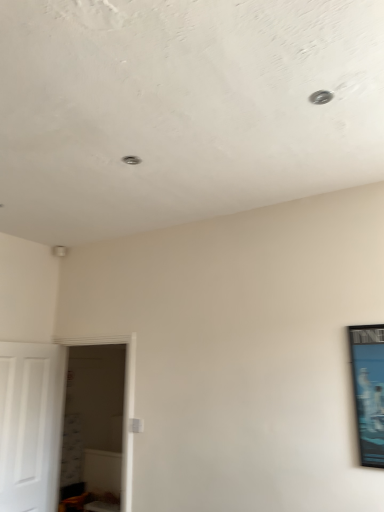
Question: Is white glossy door at left taller than metallic blue poster at right?

Choices:
 (A) yes
 (B) no

Answer: (A)

Question: Is the position of white glossy door at left more distant than that of metallic blue poster at right?

Choices:
 (A) yes
 (B) no

Answer: (A)

Question: Is white glossy door at left outside metallic blue poster at right?

Choices:
 (A) no
 (B) yes

Answer: (B)

Question: From a real-world perspective, is white glossy door at left beneath metallic blue poster at right?

Choices:
 (A) yes
 (B) no

Answer: (A)

Question: Considering the relative sizes of white glossy door at left and metallic blue poster at right in the image provided, is white glossy door at left bigger than metallic blue poster at right?

Choices:
 (A) no
 (B) yes

Answer: (B)

Question: From a real-world perspective, is white matte door at left above or below metallic blue poster at right?

Choices:
 (A) below
 (B) above

Answer: (A)

Question: Is white matte door at left in front of or behind metallic blue poster at right in the image?

Choices:
 (A) front
 (B) behind

Answer: (B)

Question: Is white matte door at left inside the boundaries of metallic blue poster at right, or outside?

Choices:
 (A) outside
 (B) inside

Answer: (A)

Question: Considering the positions of point (56, 376) and point (362, 332), is point (56, 376) closer or farther from the camera than point (362, 332)?

Choices:
 (A) farther
 (B) closer

Answer: (A)

Question: Is white matte door at left inside or outside of white glossy door at left?

Choices:
 (A) outside
 (B) inside

Answer: (A)

Question: Looking at their shapes, would you say white matte door at left is wider or thinner than white glossy door at left?

Choices:
 (A) thin
 (B) wide

Answer: (A)

Question: Is white matte door at left bigger or smaller than white glossy door at left?

Choices:
 (A) small
 (B) big

Answer: (A)

Question: Is point (34, 425) positioned closer to the camera than point (127, 440)?

Choices:
 (A) closer
 (B) farther

Answer: (B)

Question: From a real-world perspective, is metallic blue poster at right physically located above or below white matte door at left?

Choices:
 (A) above
 (B) below

Answer: (A)

Question: From the image's perspective, relative to white matte door at left, is metallic blue poster at right above or below?

Choices:
 (A) above
 (B) below

Answer: (A)